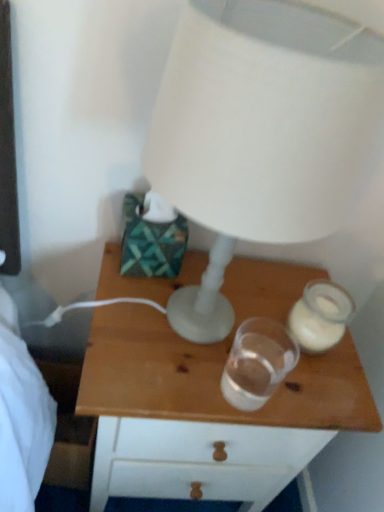
You are a GUI agent. You are given a task and a screenshot of the screen. Output one action in this format:
    pyautogui.click(x=<x>, y=<y>)
    Task: Click on the free space between translucent glass candle holder at right, the second candle holder viewed from the left, and white matte lamp at upper center
    This screenshot has height=512, width=384.
    Given the screenshot: What is the action you would take?
    pyautogui.click(x=276, y=331)